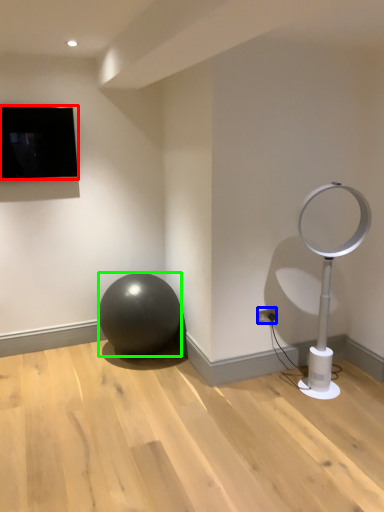
Question: Which object is positioned farthest from television (highlighted by a red box)? Select from electric outlet (highlighted by a blue box) and ball (highlighted by a green box).

Choices:
 (A) electric outlet
 (B) ball

Answer: (A)